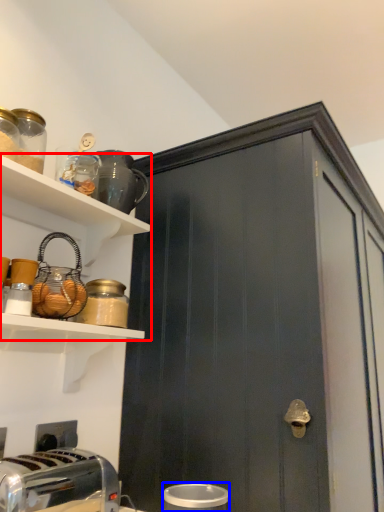
Question: Among these objects, which one is farthest to the camera, shelf (highlighted by a red box) or appliance (highlighted by a blue box)?

Choices:
 (A) shelf
 (B) appliance

Answer: (A)